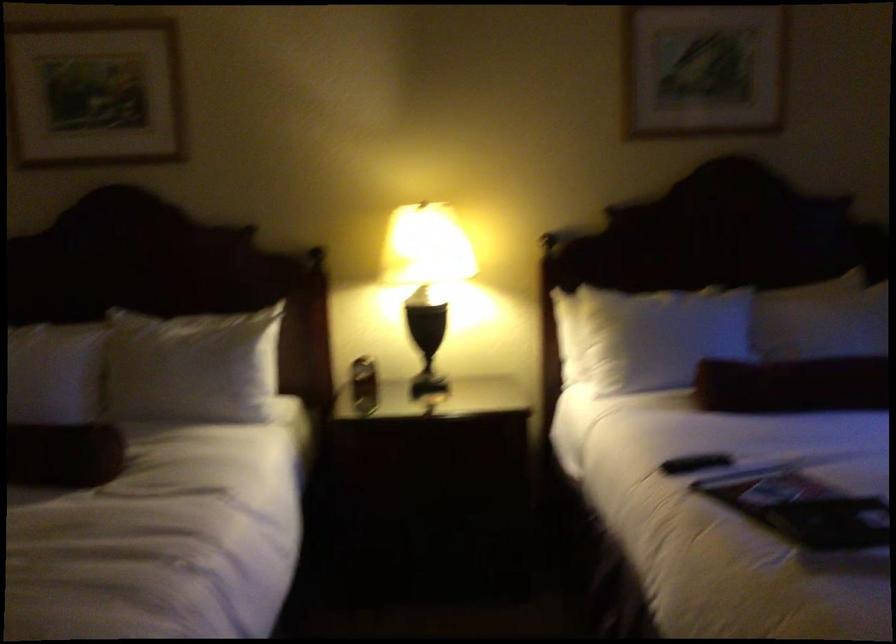
Where would you open the soda can? Please return your answer as a coordinate pair (x, y).

(364, 384)